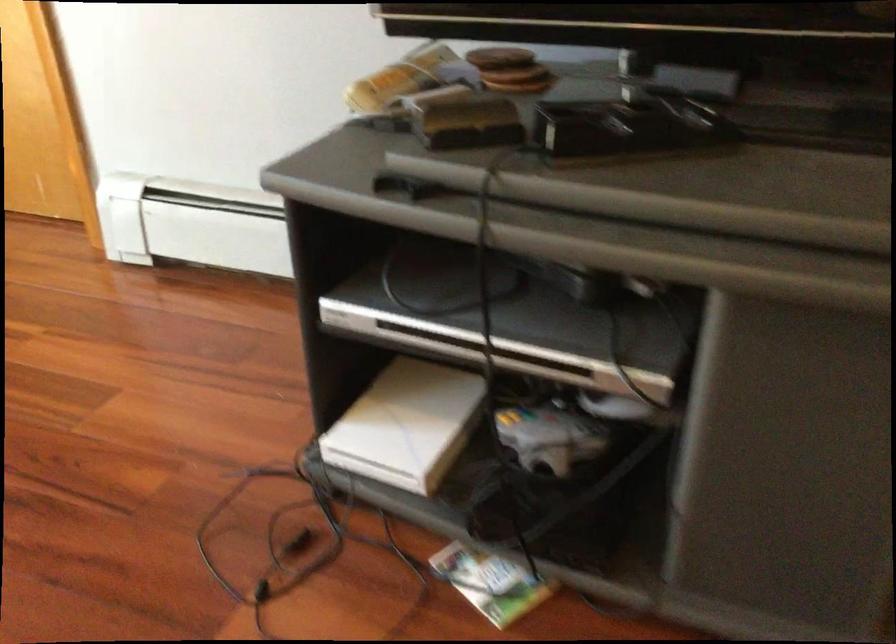
In order to click on DVD player disc slot in this screenshot , I will do `click(505, 321)`.